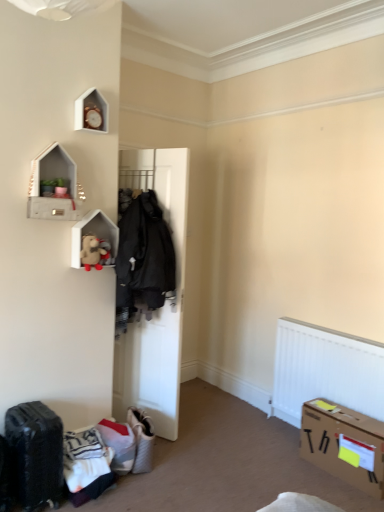
Question: Considering the positions of point (319, 442) and point (135, 159), is point (319, 442) closer or farther from the camera than point (135, 159)?

Choices:
 (A) farther
 (B) closer

Answer: (B)

Question: Looking at their shapes, would you say cardboard box at lower right is wider or thinner than white matte door at center?

Choices:
 (A) thin
 (B) wide

Answer: (B)

Question: Which object is the farthest from the concrete textured shelf at upper left, placed as the second shelf when sorted from back to front?

Choices:
 (A) fuzzy beige teddy bear at upper left
 (B) white textured fabric suitcase at lower center, the 2th luggage from the front
 (C) black textured suitcase at lower left, which is the first luggage in front-to-back order
 (D) white matte wooden shelf at upper left, which ranks as the first shelf in back-to-front order
 (E) cardboard box at lower right

Answer: (E)

Question: Which object is the farthest from the cardboard box at lower right?

Choices:
 (A) white matte wooden shelf at upper left, which is the first shelf in bottom-to-top order
 (B) fuzzy beige teddy bear at upper left
 (C) concrete textured shelf at upper left, the second shelf from the bottom
 (D) black textured suitcase at lower left, which is the first luggage in front-to-back order
 (E) white matte door at center

Answer: (C)